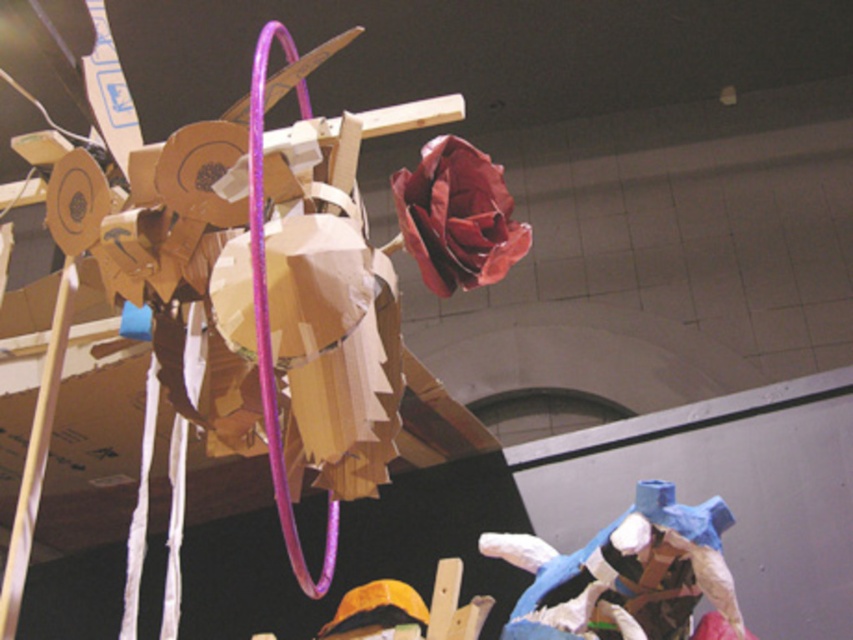
Does blue paper mache figure at lower right come in front of matte paper rose at upper center?

That is False.

Is point (587, 554) positioned behind point (473, 179)?

Yes, it is behind point (473, 179).

Where is `blue paper mache figure at lower right`? blue paper mache figure at lower right is located at coordinates (628, 576).